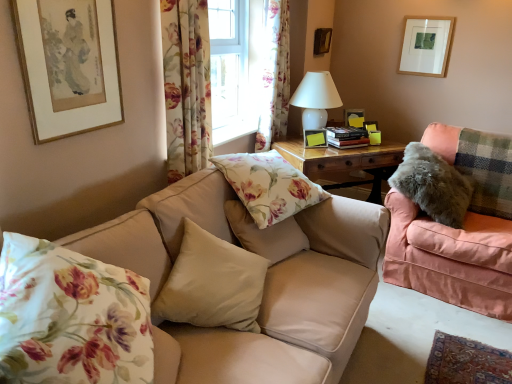
Question: Is floral fabric curtain at upper center, the first curtain when ordered from back to front, to the left or to the right of white glossy table lamp at upper center in the image?

Choices:
 (A) right
 (B) left

Answer: (B)

Question: From their relative heights in the image, would you say floral fabric curtain at upper center, placed as the first curtain when sorted from right to left, is taller or shorter than white glossy table lamp at upper center?

Choices:
 (A) tall
 (B) short

Answer: (A)

Question: Estimate the real-world distances between objects in this image. Which object is farther from the matte white picture frame at upper right, placed as the fourth picture frame when sorted from left to right?

Choices:
 (A) fuzzy gray pillow at right, the fifth pillow from the left
 (B) white glossy table lamp at upper center
 (C) fluffy pink couch at right, which is the 1th studio couch in right-to-left order
 (D) floral fabric curtain at upper center, the first curtain when ordered from back to front
 (E) matte black picture frame at center, the third picture frame when ordered from back to front

Answer: (C)

Question: Based on their relative distances, which object is nearer to the white glossy table lamp at upper center?

Choices:
 (A) floral fabric curtain at upper center, the 2th curtain from the right
 (B) floral fabric curtain at upper center, placed as the first curtain when sorted from right to left
 (C) beige fabric couch at center, which is the second studio couch from right to left
 (D) matte white picture frame at upper right, placed as the fourth picture frame when sorted from left to right
 (E) floral fabric pillow at lower left, the 1th pillow from the left

Answer: (B)